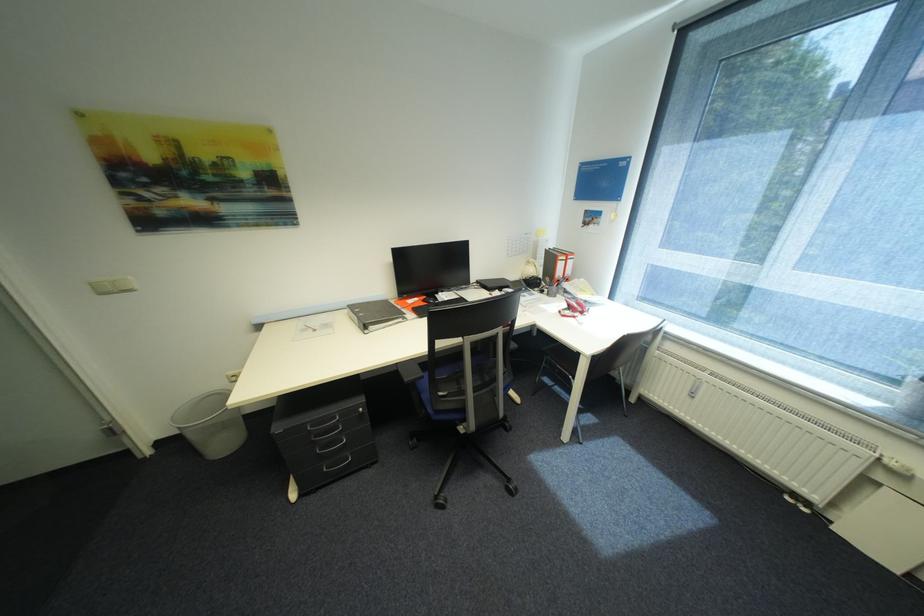
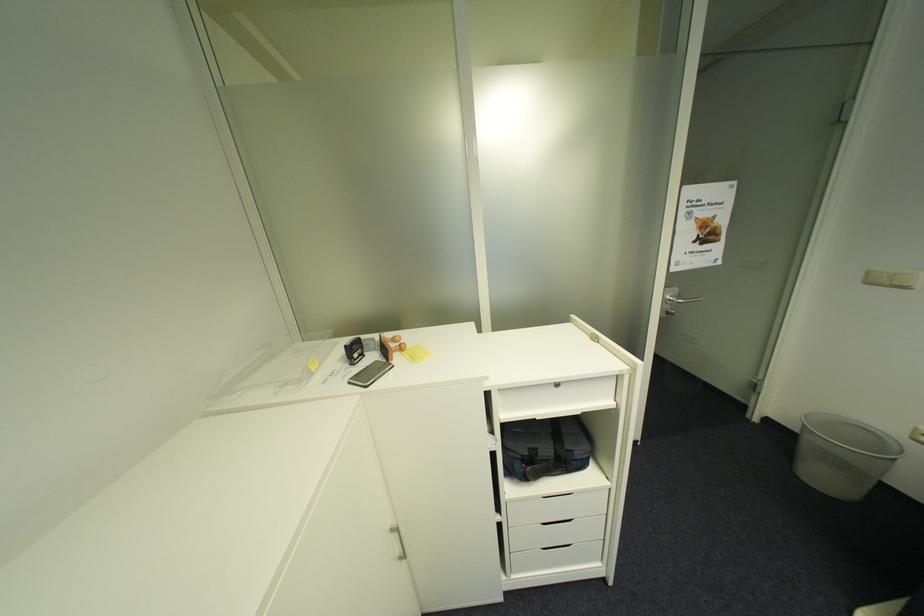
In the second image, find the point that corresponds to (185,434) in the first image.

(805, 429)